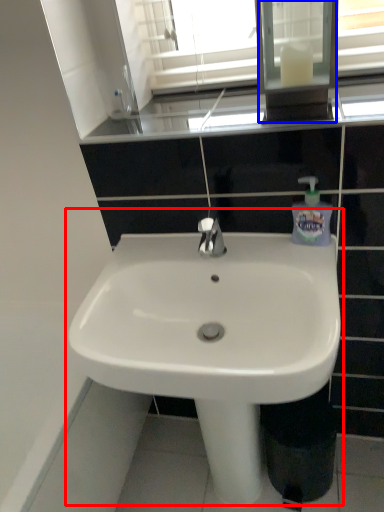
Question: Among these objects, which one is farthest to the camera, sink (highlighted by a red box) or medicine cabinet (highlighted by a blue box)?

Choices:
 (A) sink
 (B) medicine cabinet

Answer: (B)